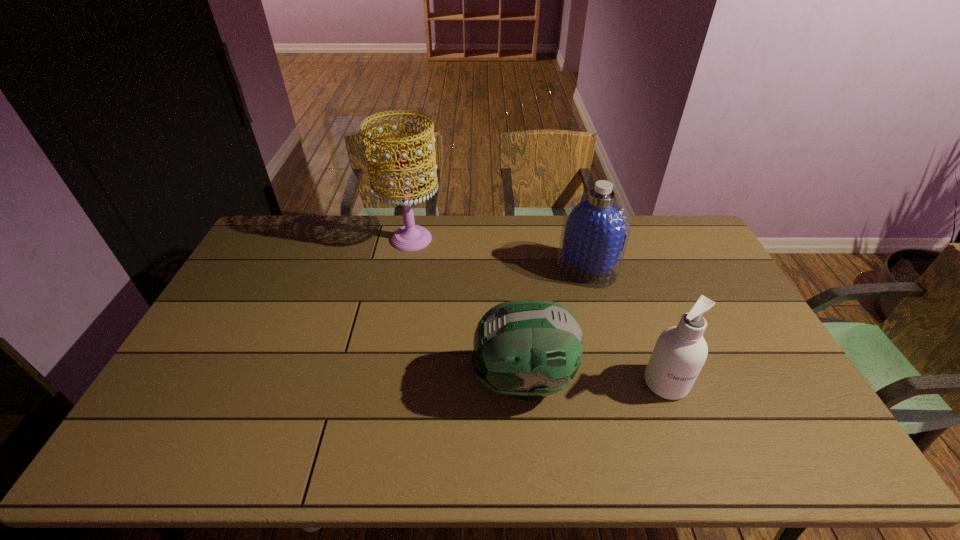
This screenshot has height=540, width=960. I want to click on lampshade that is at the far edge, so click(410, 237).

At what (x,y) coordinates should I click in order to perform the action: click on cleansing agent located in the far edge section of the desktop. Please return your answer as a coordinate pair (x, y). This screenshot has height=540, width=960. Looking at the image, I should click on (596, 227).

In the image, there is a desktop. Find the location of `vacant space at the far edge`. vacant space at the far edge is located at coordinates (634, 218).

At what (x,y) coordinates should I click in order to perform the action: click on vacant region at the near edge of the desktop. Please return your answer as a coordinate pair (x, y). Looking at the image, I should click on (653, 438).

At what (x,y) coordinates should I click in order to perform the action: click on vacant space at the left edge of the desktop. Please return your answer as a coordinate pair (x, y). The height and width of the screenshot is (540, 960). Looking at the image, I should click on (223, 367).

Where is `vacant space at the right edge of the desktop`? This screenshot has width=960, height=540. vacant space at the right edge of the desktop is located at coordinates (743, 359).

Identify the location of vacant space at the far left corner of the desktop. The height and width of the screenshot is (540, 960). (308, 222).

Identify the location of vacant space at the near left corner of the desktop. The width and height of the screenshot is (960, 540). (171, 456).

What are the coordinates of `free space at the far right corner of the desktop` in the screenshot? It's located at (653, 230).

Image resolution: width=960 pixels, height=540 pixels. I want to click on free area in between the nearer cleansing agent and the farther cleansing agent, so click(x=626, y=326).